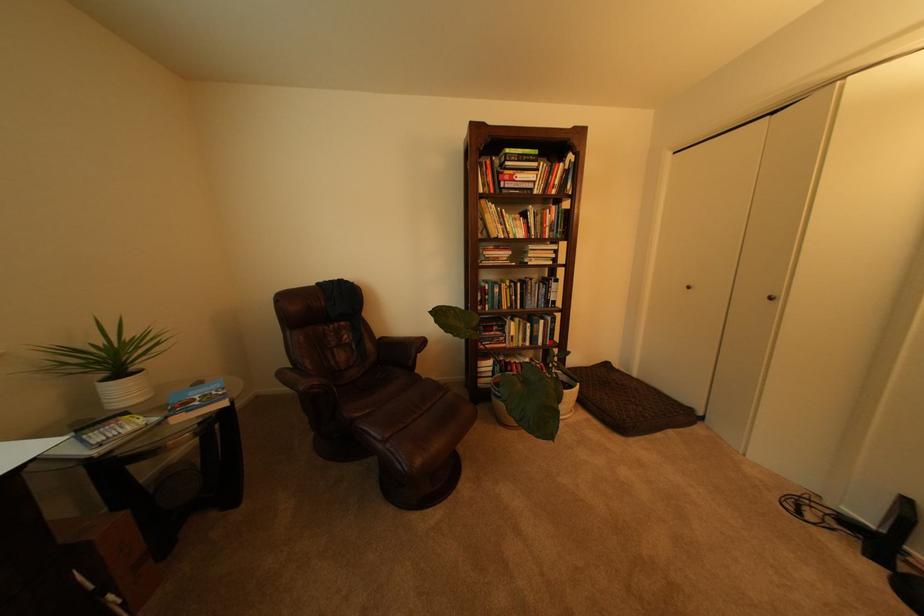
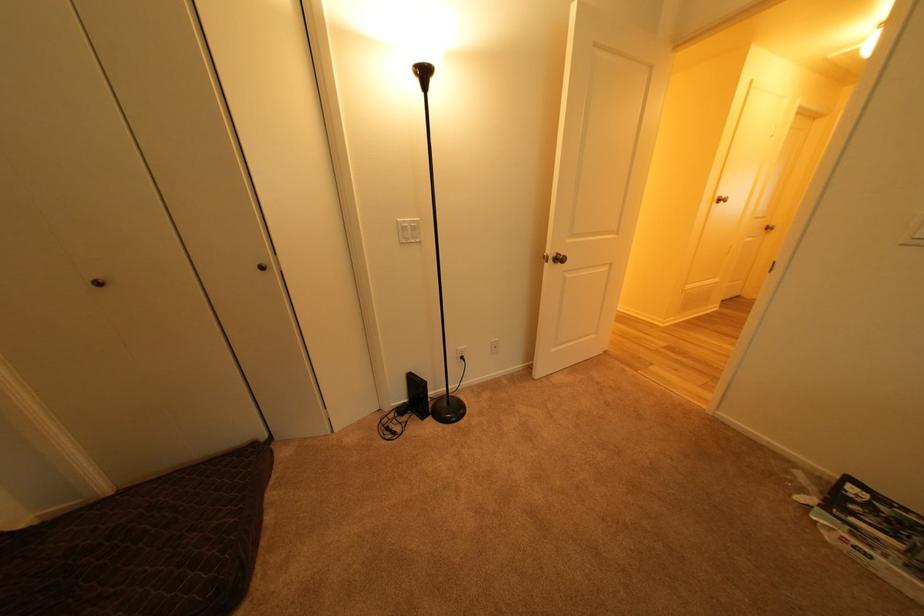
The images are taken continuously from a first-person perspective. In which direction is your viewpoint rotating?

The rotation direction of the camera is right-down.